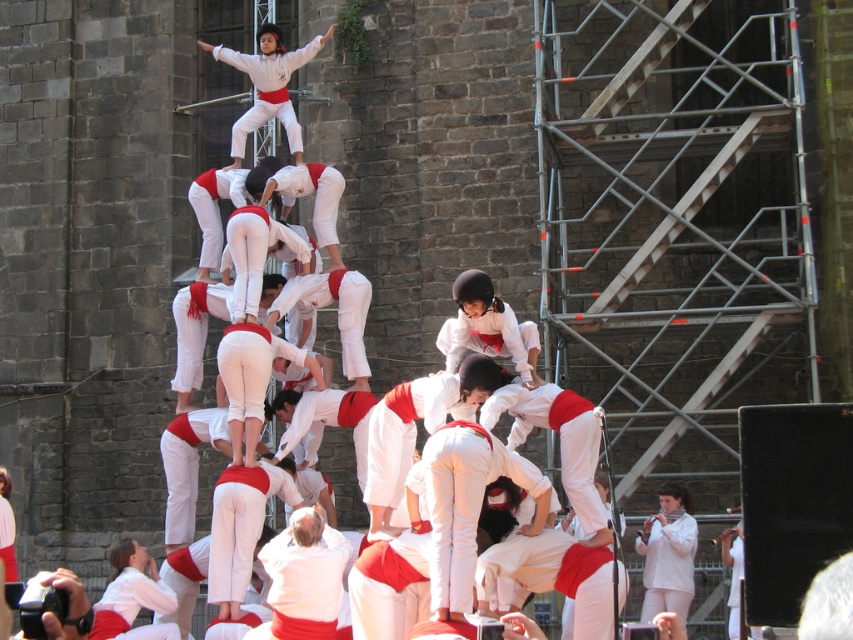
From the picture: Which is more to the left, white cotton shirt at center or white matte uniform at center?

From the viewer's perspective, white matte uniform at center appears more on the left side.

Does point (297, 557) come behind point (234, 147)?

No.

Who is more distant from viewer, (331, 570) or (238, 145)?

The point (238, 145) is behind.

The height and width of the screenshot is (640, 853). I want to click on white cotton shirt at center, so click(x=305, y=579).

Does point (334, 582) come farther from viewer compared to point (634, 547)?

No, it is not.

Who is positioned more to the right, white cotton shirt at center or white matte/soft dancer at center?

From the viewer's perspective, white matte/soft dancer at center appears more on the right side.

Which is in front, point (271, 564) or point (654, 595)?

Positioned in front is point (271, 564).

Find the location of a particular element. white cotton shirt at center is located at coordinates (305, 579).

Who is shorter, white matte/soft dancer at center or white matte uniform at center?

With less height is white matte/soft dancer at center.

Is white matte/soft dancer at center thinner than white matte uniform at center?

Correct, white matte/soft dancer at center's width is less than white matte uniform at center's.

This screenshot has width=853, height=640. Describe the element at coordinates (668, 554) in the screenshot. I see `white matte/soft dancer at center` at that location.

Where is `white matte/soft dancer at center`? The height and width of the screenshot is (640, 853). white matte/soft dancer at center is located at coordinates (668, 554).